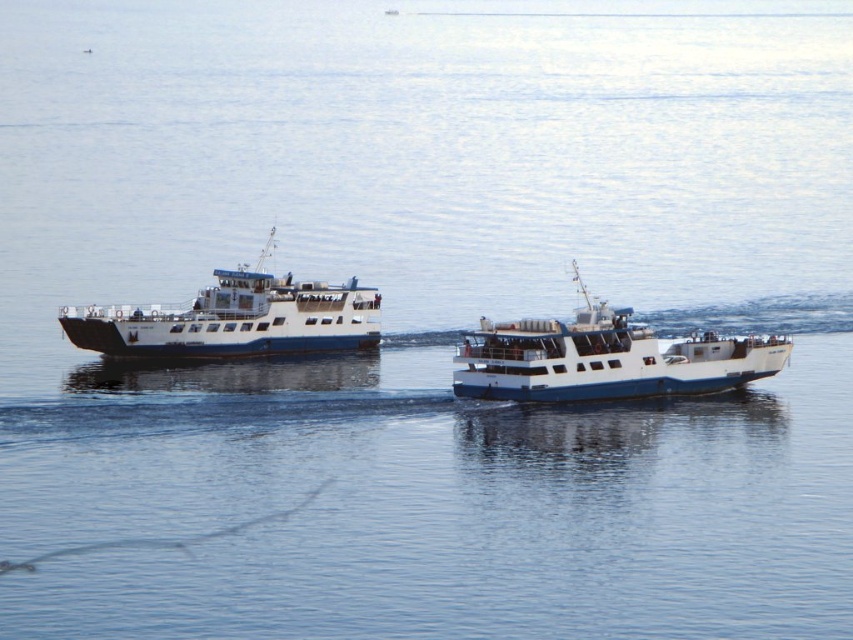
Question: Is white matte boat at center closer to the viewer compared to white matte ferry at left?

Choices:
 (A) yes
 (B) no

Answer: (A)

Question: Which of the following is the farthest from the observer?

Choices:
 (A) (77, 328)
 (B) (498, 364)

Answer: (A)

Question: Can you confirm if white matte boat at center is positioned to the right of white matte ferry at left?

Choices:
 (A) no
 (B) yes

Answer: (B)

Question: Among these objects, which one is nearest to the camera?

Choices:
 (A) white matte ferry at left
 (B) white matte boat at center

Answer: (B)

Question: Does white matte boat at center have a larger size compared to white matte ferry at left?

Choices:
 (A) no
 (B) yes

Answer: (A)